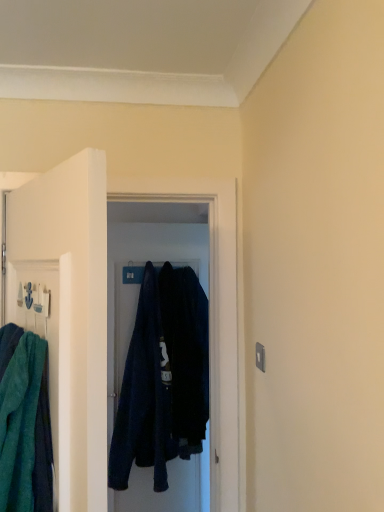
Question: From the image's perspective, does teal towel at left appear higher than dark blue fabric robe at center?

Choices:
 (A) yes
 (B) no

Answer: (A)

Question: Can you confirm if teal towel at left is smaller than dark blue fabric robe at center?

Choices:
 (A) no
 (B) yes

Answer: (B)

Question: Is teal towel at left directly adjacent to dark blue fabric robe at center?

Choices:
 (A) yes
 (B) no

Answer: (B)

Question: Does teal towel at left turn towards dark blue fabric robe at center?

Choices:
 (A) no
 (B) yes

Answer: (A)

Question: Does teal towel at left have a greater width compared to dark blue fabric robe at center?

Choices:
 (A) yes
 (B) no

Answer: (B)

Question: Considering their positions, is dark blue fabric at center located in front of or behind dark blue fabric robe at center?

Choices:
 (A) behind
 (B) front

Answer: (A)

Question: From their relative heights in the image, would you say dark blue fabric at center is taller or shorter than dark blue fabric robe at center?

Choices:
 (A) short
 (B) tall

Answer: (B)

Question: Is dark blue fabric at center inside or outside of dark blue fabric robe at center?

Choices:
 (A) inside
 (B) outside

Answer: (B)

Question: Looking at the image, does dark blue fabric at center seem bigger or smaller compared to dark blue fabric robe at center?

Choices:
 (A) big
 (B) small

Answer: (A)

Question: Considering the relative positions of dark blue fabric robe at center and teal towel at left in the image provided, is dark blue fabric robe at center to the left or to the right of teal towel at left?

Choices:
 (A) right
 (B) left

Answer: (A)

Question: Choose the correct answer: Is dark blue fabric robe at center inside teal towel at left or outside it?

Choices:
 (A) outside
 (B) inside

Answer: (A)

Question: From a real-world perspective, relative to teal towel at left, is dark blue fabric robe at center vertically above or below?

Choices:
 (A) below
 (B) above

Answer: (A)

Question: From their relative heights in the image, would you say dark blue fabric robe at center is taller or shorter than teal towel at left?

Choices:
 (A) short
 (B) tall

Answer: (B)

Question: Choose the correct answer: Is dark blue fabric at center inside teal towel at left or outside it?

Choices:
 (A) outside
 (B) inside

Answer: (A)

Question: From a real-world perspective, is dark blue fabric at center above or below teal towel at left?

Choices:
 (A) above
 (B) below

Answer: (B)